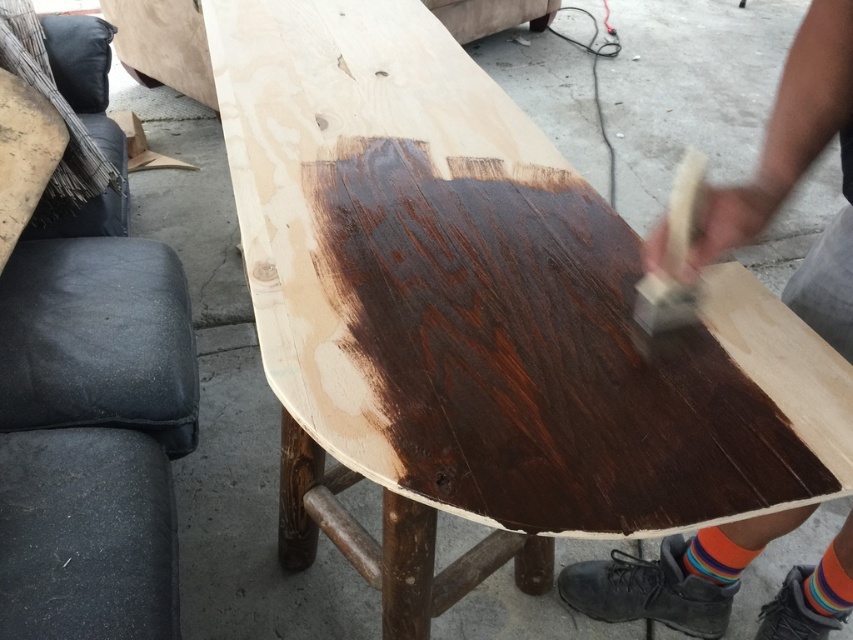
Question: In this image, where is rainbow socks at lower right located relative to multicolored fabric sock at lower right?

Choices:
 (A) below
 (B) above

Answer: (B)

Question: Can you confirm if wooden textured hammer at right is positioned below rainbow socks at lower right?

Choices:
 (A) yes
 (B) no

Answer: (B)

Question: Which point is farther from the camera taking this photo?

Choices:
 (A) (10, 264)
 (B) (730, 557)
 (C) (688, 202)
 (D) (614, 618)

Answer: (D)

Question: Is black leather stool at lower left closer to camera compared to wooden paintbrush at center?

Choices:
 (A) no
 (B) yes

Answer: (B)

Question: Which point is farther to the camera?

Choices:
 (A) multicolored fabric sock at lower right
 (B) black leather stool at lower left

Answer: (A)

Question: Which point is closer to the camera?

Choices:
 (A) (693, 177)
 (B) (770, 161)

Answer: (A)